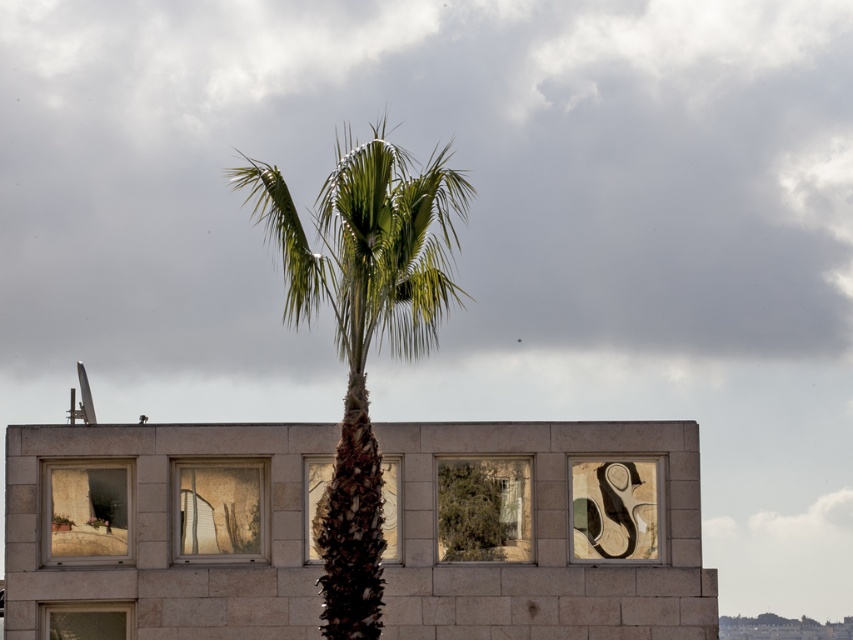
Is point (386, 182) closer to camera compared to point (498, 492)?

Yes, it is in front of point (498, 492).

Is green leafy palm tree at center to the left of green leafy tree at center from the viewer's perspective?

Indeed, green leafy palm tree at center is positioned on the left side of green leafy tree at center.

Find the location of a particular element. This screenshot has height=640, width=853. green leafy palm tree at center is located at coordinates (363, 324).

What are the coordinates of `green leafy palm tree at center` in the screenshot? It's located at (363, 324).